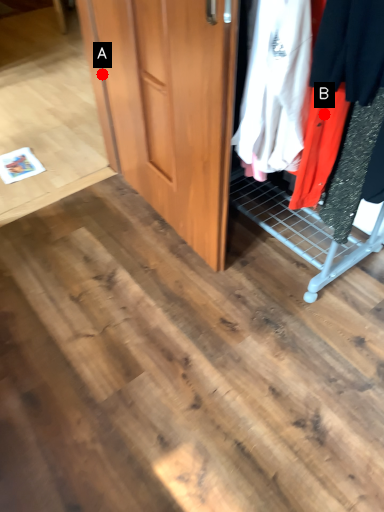
Question: Two points are circled on the image, labeled by A and B beside each circle. Which point is further to the camera?

Choices:
 (A) A is further
 (B) B is further

Answer: (A)